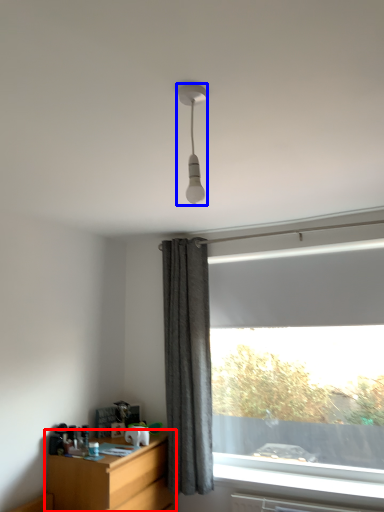
Question: Among these objects, which one is nearest to the camera, desk (highlighted by a red box) or lamp (highlighted by a blue box)?

Choices:
 (A) desk
 (B) lamp

Answer: (B)